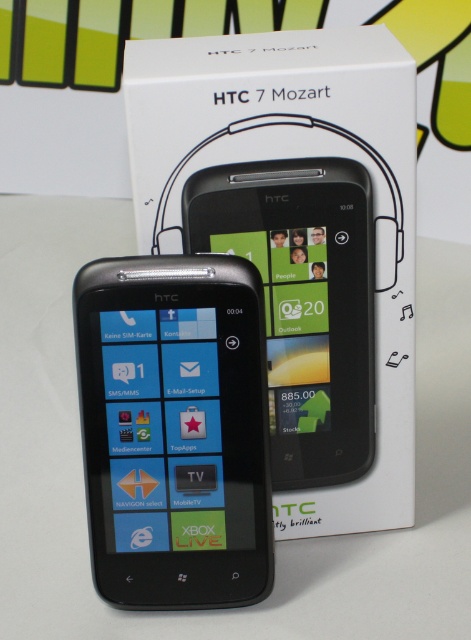
Which of these two, matte black phone at center or black glossy smartphone at center, stands shorter?

Standing shorter between the two is black glossy smartphone at center.

Is point (159, 464) behind point (262, 264)?

No, (159, 464) is in front of (262, 264).

Image resolution: width=471 pixels, height=640 pixels. Find the location of `matte black phone at center`. matte black phone at center is located at coordinates (175, 429).

Does white matte htc 7 mozart box at center appear over matte black phone at center?

Yes, white matte htc 7 mozart box at center is above matte black phone at center.

Is point (338, 336) farther from viewer compared to point (162, 394)?

That is True.

Is point (329, 452) positioned in front of point (155, 497)?

No, it is not.

Identify the location of white matte htc 7 mozart box at center. pyautogui.click(x=299, y=241).

Measure the distance between white matte htc 7 mozart box at center and black glossy smartphone at center.

white matte htc 7 mozart box at center is 1.62 inches away from black glossy smartphone at center.

Does white matte htc 7 mozart box at center appear on the left side of black glossy smartphone at center?

Correct, you'll find white matte htc 7 mozart box at center to the left of black glossy smartphone at center.

Who is more distant from viewer, (327, 502) or (338, 237)?

The point (327, 502) is behind.

Where is `white matte htc 7 mozart box at center`? white matte htc 7 mozart box at center is located at coordinates (299, 241).